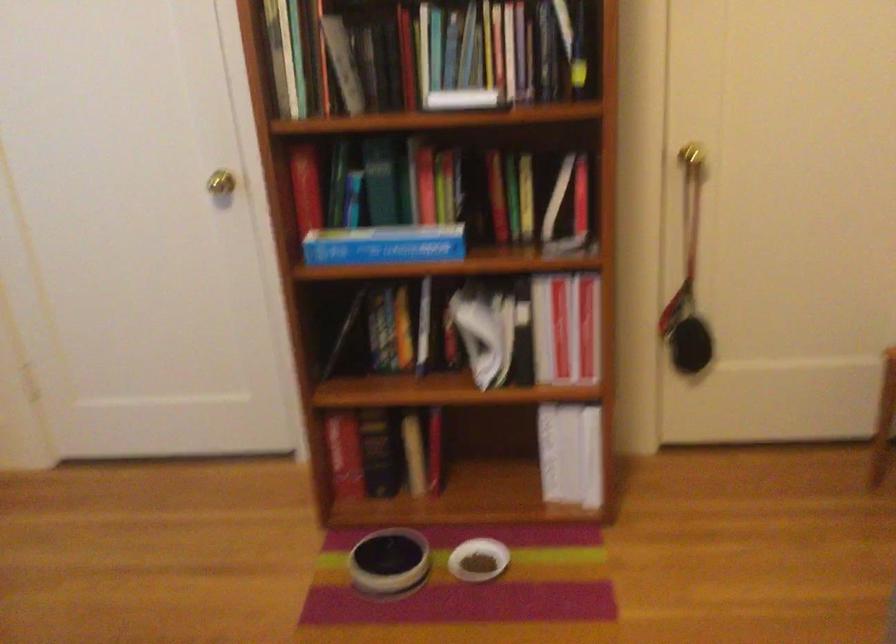
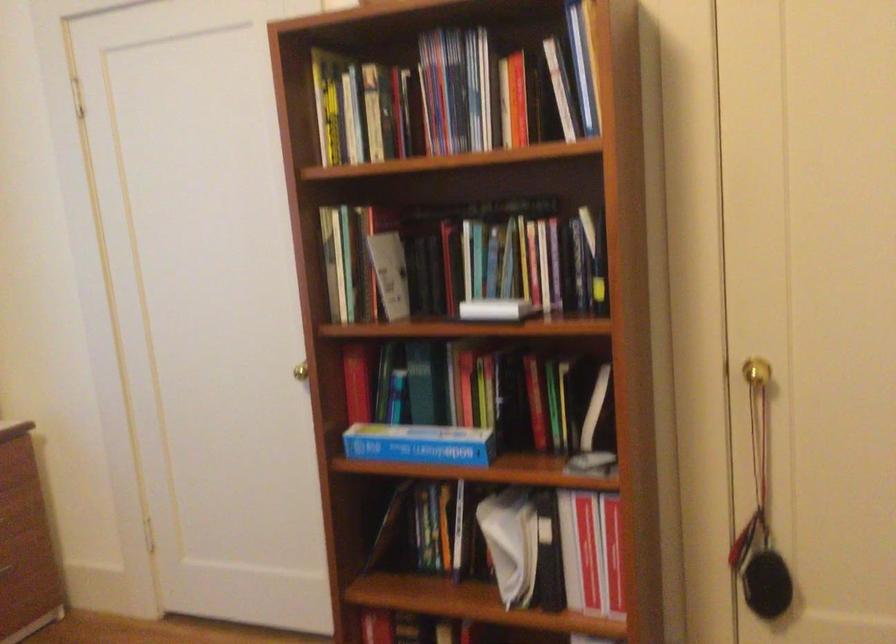
Locate, in the second image, the point that corresponds to [392,243] in the first image.

(419, 444)